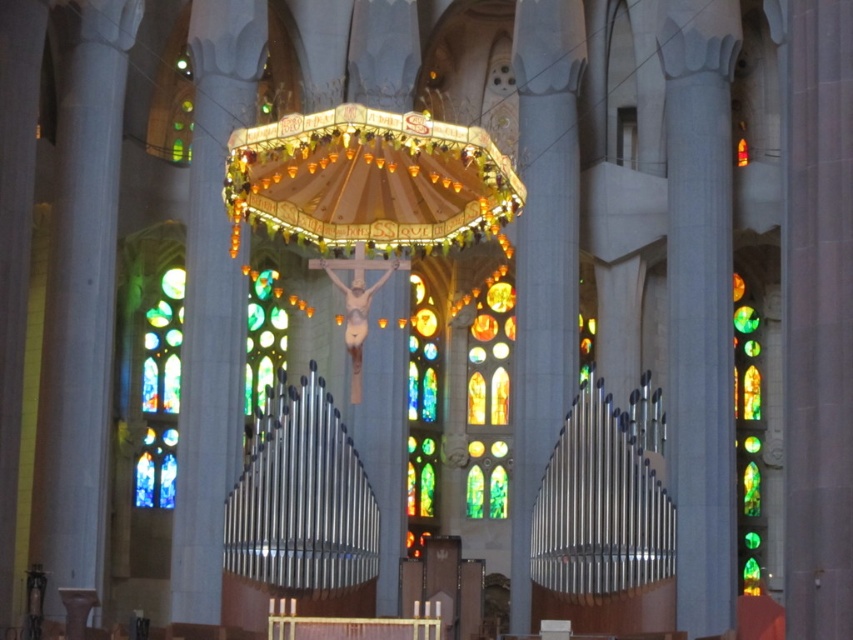
You are an architect visiting the cathedral and want to take a photo of the stained glass window at right and multicolored stained glass at center. Which one is positioned to the right side of the other?

The stained glass window at right is positioned to the right of the multicolored stained glass at center.